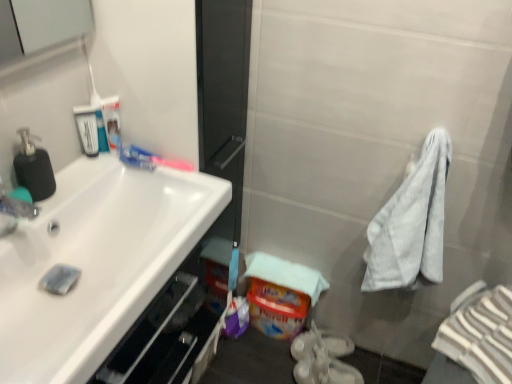
At what (x,y) coordinates should I click in order to perform the action: click on vacant space behind matte black soap dispenser at left. Please return your answer as a coordinate pair (x, y). Looking at the image, I should click on (87, 173).